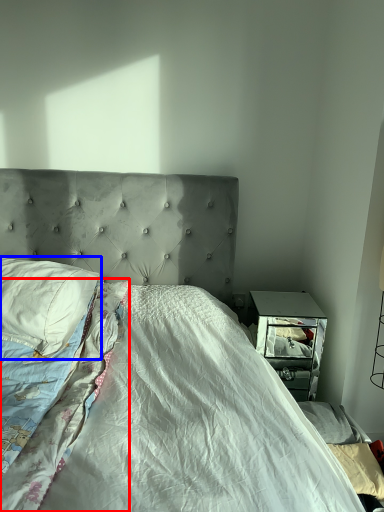
Question: Which of the following is the closest to the observer, blanket (highlighted by a red box) or pillow (highlighted by a blue box)?

Choices:
 (A) blanket
 (B) pillow

Answer: (A)